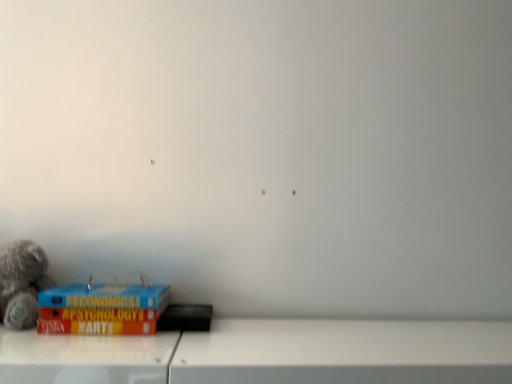
Measure the distance between point (8, 278) and camera.

Point (8, 278) is 37.91 inches from camera.

This screenshot has height=384, width=512. Identify the location of fluffy gray teddy bear at left. (22, 283).

The image size is (512, 384). Describe the element at coordinates (22, 283) in the screenshot. I see `fluffy gray teddy bear at left` at that location.

Measure the distance between point (139, 289) and camera.

Point (139, 289) is 37.17 inches from camera.

This screenshot has width=512, height=384. Describe the element at coordinates (101, 309) in the screenshot. I see `blue hardcover book at lower left` at that location.

The width and height of the screenshot is (512, 384). I want to click on blue hardcover book at lower left, so click(x=101, y=309).

Where is `fluffy gray teddy bear at left`? fluffy gray teddy bear at left is located at coordinates (22, 283).

Considering the relative positions of blue hardcover book at lower left and fluffy gray teddy bear at left in the image provided, is blue hardcover book at lower left to the left or to the right of fluffy gray teddy bear at left?

From the image, it's evident that blue hardcover book at lower left is to the right of fluffy gray teddy bear at left.

Is blue hardcover book at lower left behind fluffy gray teddy bear at left?

No, blue hardcover book at lower left is in front of fluffy gray teddy bear at left.

Is point (75, 312) in front of point (16, 272)?

Yes, it is.

Consider the image. From the image's perspective, which one is positioned higher, blue hardcover book at lower left or fluffy gray teddy bear at left?

From the image's view, fluffy gray teddy bear at left is above.

From a real-world perspective, who is located lower, blue hardcover book at lower left or fluffy gray teddy bear at left?

blue hardcover book at lower left, from a real-world perspective.

Considering the sizes of objects blue hardcover book at lower left and fluffy gray teddy bear at left in the image provided, who is thinner, blue hardcover book at lower left or fluffy gray teddy bear at left?

With smaller width is fluffy gray teddy bear at left.

Considering the sizes of objects blue hardcover book at lower left and fluffy gray teddy bear at left in the image provided, who is shorter, blue hardcover book at lower left or fluffy gray teddy bear at left?

blue hardcover book at lower left is shorter.

Who is bigger, blue hardcover book at lower left or fluffy gray teddy bear at left?

With larger size is blue hardcover book at lower left.

Looking at this image, is blue hardcover book at lower left not within fluffy gray teddy bear at left?

Absolutely, blue hardcover book at lower left is external to fluffy gray teddy bear at left.

Would you consider blue hardcover book at lower left to be distant from fluffy gray teddy bear at left?

blue hardcover book at lower left is near fluffy gray teddy bear at left, not far away.

Is blue hardcover book at lower left oriented towards fluffy gray teddy bear at left?

No, blue hardcover book at lower left is not oriented towards fluffy gray teddy bear at left.

Identify the location of paperback book below the fluffy gray teddy bear at left (from a real-world perspective). The height and width of the screenshot is (384, 512). (101, 309).

Would you say fluffy gray teddy bear at left is to the left or to the right of blue hardcover book at lower left in the picture?

In the image, fluffy gray teddy bear at left appears on the left side of blue hardcover book at lower left.

Is fluffy gray teddy bear at left positioned behind blue hardcover book at lower left?

Yes, fluffy gray teddy bear at left is further from the viewer.

Does point (16, 302) appear closer or farther from the camera than point (115, 301)?

Point (16, 302) is farther from the camera than point (115, 301).

From the image's perspective, is fluffy gray teddy bear at left located above blue hardcover book at lower left?

Indeed, from the image's perspective, fluffy gray teddy bear at left is shown above blue hardcover book at lower left.

From a real-world perspective, which is physically above, fluffy gray teddy bear at left or blue hardcover book at lower left?

From a 3D spatial view, fluffy gray teddy bear at left is above.

Is fluffy gray teddy bear at left wider or thinner than blue hardcover book at lower left?

Considering their sizes, fluffy gray teddy bear at left looks slimmer than blue hardcover book at lower left.

Looking at this image, between fluffy gray teddy bear at left and blue hardcover book at lower left, which one has more height?

fluffy gray teddy bear at left.

Which of these two, fluffy gray teddy bear at left or blue hardcover book at lower left, is smaller?

fluffy gray teddy bear at left.

Is blue hardcover book at lower left a part of fluffy gray teddy bear at left?

No, blue hardcover book at lower left is not a part of fluffy gray teddy bear at left.

Is fluffy gray teddy bear at left with blue hardcover book at lower left?

fluffy gray teddy bear at left and blue hardcover book at lower left are clearly separated.

Is fluffy gray teddy bear at left facing away from blue hardcover book at lower left?

fluffy gray teddy bear at left is not turned away from blue hardcover book at lower left.

How many degrees apart are the facing directions of fluffy gray teddy bear at left and blue hardcover book at lower left?

fluffy gray teddy bear at left and blue hardcover book at lower left are facing 10.9 degrees away from each other.

The height and width of the screenshot is (384, 512). I want to click on toy behind the blue hardcover book at lower left, so click(22, 283).

Identify the location of toy above the blue hardcover book at lower left (from a real-world perspective). This screenshot has height=384, width=512. (22, 283).

In order to click on toy on the left side of blue hardcover book at lower left in this screenshot , I will do `click(22, 283)`.